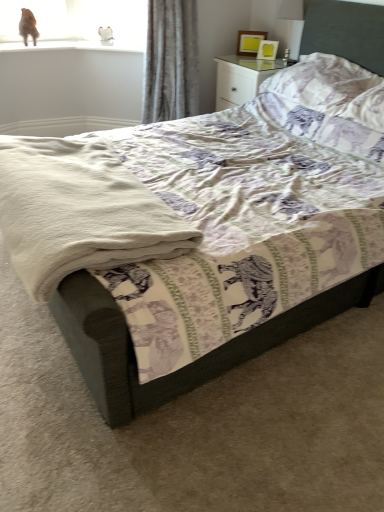
What do you see at coordinates (171, 61) in the screenshot? I see `gray velvet curtain at upper center` at bounding box center [171, 61].

This screenshot has width=384, height=512. Describe the element at coordinates (249, 42) in the screenshot. I see `matte yellow picture frame at upper right` at that location.

Locate an element on the screen. gray velvet curtain at upper center is located at coordinates (171, 61).

Considering the relative sizes of gray velvet curtain at upper center and brown fur cat at upper left in the image provided, is gray velvet curtain at upper center bigger than brown fur cat at upper left?

Correct, gray velvet curtain at upper center is larger in size than brown fur cat at upper left.

Looking at this image, can you tell me how much gray velvet curtain at upper center and brown fur cat at upper left differ in facing direction?

The facing directions of gray velvet curtain at upper center and brown fur cat at upper left are 19.9 degrees apart.

Does gray velvet curtain at upper center appear on the left side of brown fur cat at upper left?

Incorrect, gray velvet curtain at upper center is not on the left side of brown fur cat at upper left.

Which object is thinner, gray velvet curtain at upper center or brown fur cat at upper left?

Thinner between the two is brown fur cat at upper left.

Where is `material lying on the left of white glossy nightstand at upper right`? material lying on the left of white glossy nightstand at upper right is located at coordinates (79, 211).

Considering the relative positions of white glossy nightstand at upper right and white soft blanket at lower left in the image provided, is white glossy nightstand at upper right to the left or to the right of white soft blanket at lower left?

In the image, white glossy nightstand at upper right appears on the right side of white soft blanket at lower left.

Is white glossy nightstand at upper right beside white soft blanket at lower left?

white glossy nightstand at upper right and white soft blanket at lower left are clearly separated.

Can you tell me how much white glossy nightstand at upper right and white soft blanket at lower left differ in facing direction?

The angular difference between white glossy nightstand at upper right and white soft blanket at lower left is 1.12 degrees.

Based on the photo, is matte yellow picture frame at upper right bigger than purple printed pillow at upper right?

No, matte yellow picture frame at upper right is not bigger than purple printed pillow at upper right.

Is matte yellow picture frame at upper right inside the boundaries of purple printed pillow at upper right, or outside?

The correct answer is: outside.

Based on the photo, does white glossy nightstand at upper right have a greater width compared to purple printed pillow at upper right?

Correct, the width of white glossy nightstand at upper right exceeds that of purple printed pillow at upper right.

Between point (247, 67) and point (298, 70), which one is positioned behind?

The point (247, 67) is more distant.

From a real-world perspective, is white glossy nightstand at upper right physically above purple printed pillow at upper right?

No, from a real-world perspective, white glossy nightstand at upper right is not over purple printed pillow at upper right

Between white glossy nightstand at upper right and purple printed pillow at upper right, which one has less height?

purple printed pillow at upper right.

Is white glossy nightstand at upper right facing towards brown fur cat at upper left?

No, white glossy nightstand at upper right is not aimed at brown fur cat at upper left.

Are white glossy nightstand at upper right and brown fur cat at upper left making contact?

They are not placed beside each other.

Between white glossy nightstand at upper right and brown fur cat at upper left, which one has smaller width?

With smaller width is brown fur cat at upper left.

Which object is further away from the camera taking this photo, white glossy nightstand at upper right or brown fur cat at upper left?

brown fur cat at upper left is more distant.

Based on the photo, from a real-world perspective, is gray velvet curtain at upper center physically located above or below matte yellow picture frame at upper right?

From a real-world perspective, gray velvet curtain at upper center is physically below matte yellow picture frame at upper right.

Considering the sizes of objects gray velvet curtain at upper center and matte yellow picture frame at upper right in the image provided, who is wider, gray velvet curtain at upper center or matte yellow picture frame at upper right?

Wider between the two is gray velvet curtain at upper center.

Could you tell me if gray velvet curtain at upper center is turned towards matte yellow picture frame at upper right?

No, gray velvet curtain at upper center is not oriented towards matte yellow picture frame at upper right.

Who is bigger, matte yellow picture frame at upper right or white glossy nightstand at upper right?

white glossy nightstand at upper right is bigger.

Where is `nightstand that appears below the matte yellow picture frame at upper right (from the image's perspective)`? Image resolution: width=384 pixels, height=512 pixels. nightstand that appears below the matte yellow picture frame at upper right (from the image's perspective) is located at coordinates (241, 78).

Is matte yellow picture frame at upper right positioned beyond the bounds of white glossy nightstand at upper right?

That's correct, matte yellow picture frame at upper right is outside of white glossy nightstand at upper right.

The image size is (384, 512). What are the coordinates of `animal positioned vertically above the gray velvet curtain at upper center (from a real-world perspective)` in the screenshot? It's located at (28, 26).

Identify the location of material to the left of white glossy nightstand at upper right. (79, 211).

Estimate the real-world distances between objects in this image. Which object is closer to white soft blanket at lower left, white glossy nightstand at upper right or purple printed pillow at upper right?

purple printed pillow at upper right is closer to white soft blanket at lower left.

Looking at the image, which one is located further to white soft blanket at lower left, matte yellow picture frame at upper right or brown fur cat at upper left?

Among the two, matte yellow picture frame at upper right is located further to white soft blanket at lower left.

Based on their spatial positions, is white glossy nightstand at upper right or brown fur cat at upper left further from white soft blanket at lower left?

brown fur cat at upper left is further to white soft blanket at lower left.

When comparing their distances from white soft blanket at lower left, does matte yellow picture frame at upper right or white glossy nightstand at upper right seem further?

matte yellow picture frame at upper right lies further to white soft blanket at lower left than the other object.

Estimate the real-world distances between objects in this image. Which object is further from matte yellow picture frame at upper right, brown fur cat at upper left or purple printed pillow at upper right?

brown fur cat at upper left.

Based on their spatial positions, is white soft blanket at lower left or matte yellow picture frame at upper right closer to white glossy nightstand at upper right?

matte yellow picture frame at upper right.

When comparing their distances from gray velvet curtain at upper center, does white glossy nightstand at upper right or white soft blanket at lower left seem closer?

Among the two, white glossy nightstand at upper right is located nearer to gray velvet curtain at upper center.

Which object lies further to the anchor point white soft blanket at lower left, purple printed pillow at upper right or matte yellow picture frame at upper right?

matte yellow picture frame at upper right is further to white soft blanket at lower left.

Identify the location of animal between white soft blanket at lower left and matte yellow picture frame at upper right in the front-back direction. This screenshot has height=512, width=384. (28, 26).

Identify the location of curtain between brown fur cat at upper left and purple printed pillow at upper right from left to right. (171, 61).

Where is `nightstand between white soft blanket at lower left and matte yellow picture frame at upper right along the z-axis`? This screenshot has width=384, height=512. nightstand between white soft blanket at lower left and matte yellow picture frame at upper right along the z-axis is located at coordinates (241, 78).

Identify the location of picture frame situated between brown fur cat at upper left and purple printed pillow at upper right from left to right. This screenshot has width=384, height=512. (249, 42).